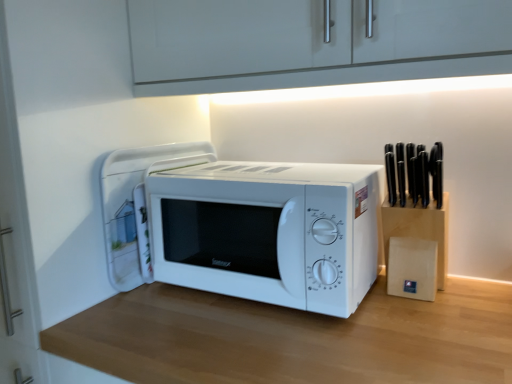
Measure the distance between white glossy microwave at center and camera.

white glossy microwave at center and camera are 35.20 inches apart.

Measure the distance between point (329, 275) and camera.

Point (329, 275) and camera are 30.04 inches apart from each other.

The image size is (512, 384). Find the location of `white glossy microwave at center`. white glossy microwave at center is located at coordinates (136, 206).

Considering the positions of objects wooden table at center and white matte microwave at center in the image provided, who is more to the left, wooden table at center or white matte microwave at center?

From the viewer's perspective, white matte microwave at center appears more on the left side.

Can you tell me how much wooden table at center and white matte microwave at center differ in facing direction?

The angular difference between wooden table at center and white matte microwave at center is 1.12 degrees.

Is point (498, 303) closer or farther from the camera than point (358, 267)?

Clearly, point (498, 303) is more distant from the camera than point (358, 267).

Image resolution: width=512 pixels, height=384 pixels. I want to click on table beneath the white matte microwave at center (from a real-world perspective), so click(293, 338).

Is wooden table at center outside of white glossy microwave at center?

wooden table at center is positioned outside white glossy microwave at center.

Is the surface of wooden table at center in direct contact with white glossy microwave at center?

No, wooden table at center is not next to white glossy microwave at center.

Who is bigger, wooden table at center or white glossy microwave at center?

wooden table at center.

From the image's perspective, does wooden table at center appear higher than white glossy microwave at center?

No, from the image's perspective, wooden table at center is not above white glossy microwave at center.

In the scene shown: Which of these two, white glossy microwave at center or wooden table at center, is wider?

wooden table at center.

From the image's perspective, is white glossy microwave at center over wooden table at center?

Yes, from the image's perspective, white glossy microwave at center is on top of wooden table at center.

Looking at this image, measure the distance between white glossy microwave at center and wooden table at center.

A distance of 13.21 inches exists between white glossy microwave at center and wooden table at center.

Is white glossy microwave at center shorter than wooden table at center?

Correct, white glossy microwave at center is not as tall as wooden table at center.

Considering the relative sizes of white matte microwave at center and white glossy microwave at center in the image provided, is white matte microwave at center taller than white glossy microwave at center?

No.

Is white matte microwave at center not within white glossy microwave at center?

Absolutely, white matte microwave at center is external to white glossy microwave at center.

At what (x,y) coordinates should I click in order to perform the action: click on microwave oven below the white glossy microwave at center (from the image's perspective). Please return your answer as a coordinate pair (x, y). The height and width of the screenshot is (384, 512). Looking at the image, I should click on (269, 231).

Is point (259, 252) positioned in front of point (170, 149)?

Yes.

Is point (192, 284) farther from viewer compared to point (457, 318)?

Yes, point (192, 284) is behind point (457, 318).

From the image's perspective, who appears lower, white matte microwave at center or wooden table at center?

wooden table at center, from the image's perspective.

Which object is further away from the camera, white matte microwave at center or wooden table at center?

white matte microwave at center.

Where is `table below the white matte microwave at center (from the image's perspective)`? table below the white matte microwave at center (from the image's perspective) is located at coordinates (293, 338).

Is white glossy microwave at center beside white matte microwave at center?

No.

From the image's perspective, is white glossy microwave at center located above white matte microwave at center?

Yes.

Where is `microwave oven that is in front of the white glossy microwave at center`? microwave oven that is in front of the white glossy microwave at center is located at coordinates (269, 231).

Where is `table in front of the white matte microwave at center`? table in front of the white matte microwave at center is located at coordinates (293, 338).

In order to click on table that appears below the white glossy microwave at center (from a real-world perspective) in this screenshot , I will do `click(293, 338)`.

In the scene shown: Which object lies nearer to the anchor point white matte microwave at center, white glossy microwave at center or wooden table at center?

wooden table at center is closer to white matte microwave at center.

Which object lies further to the anchor point white glossy microwave at center, white matte microwave at center or wooden table at center?

Based on the image, wooden table at center appears to be further to white glossy microwave at center.

From the image, which object appears to be nearer to white glossy microwave at center, wooden table at center or white matte microwave at center?

white matte microwave at center.

Estimate the real-world distances between objects in this image. Which object is further from wooden table at center, white matte microwave at center or white glossy microwave at center?

white glossy microwave at center lies further to wooden table at center than the other object.

Which object lies nearer to the anchor point white matte microwave at center, wooden table at center or white glossy microwave at center?

wooden table at center is positioned closer to the anchor white matte microwave at center.

Which object lies nearer to the anchor point wooden table at center, white glossy microwave at center or white matte microwave at center?

Based on the image, white matte microwave at center appears to be nearer to wooden table at center.

Where is `microwave oven located between wooden table at center and white glossy microwave at center in the depth direction`? microwave oven located between wooden table at center and white glossy microwave at center in the depth direction is located at coordinates (269, 231).